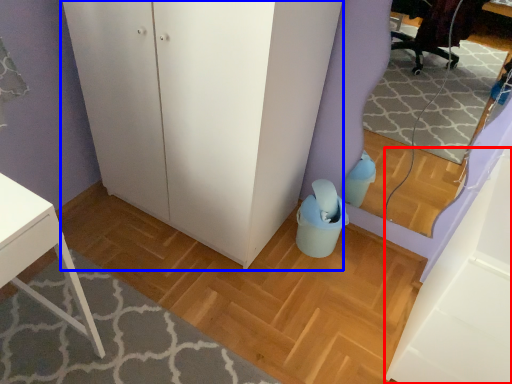
Question: Among these objects, which one is nearest to the camera, cabinetry (highlighted by a red box) or dresser (highlighted by a blue box)?

Choices:
 (A) cabinetry
 (B) dresser

Answer: (A)